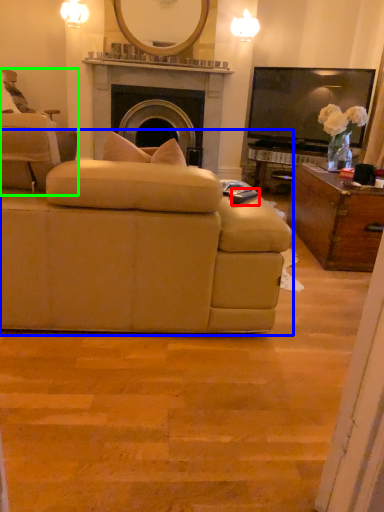
Question: Based on their relative distances, which object is nearer to remote control (highlighted by a red box)? Choose from studio couch (highlighted by a blue box) and chair (highlighted by a green box).

Choices:
 (A) studio couch
 (B) chair

Answer: (A)